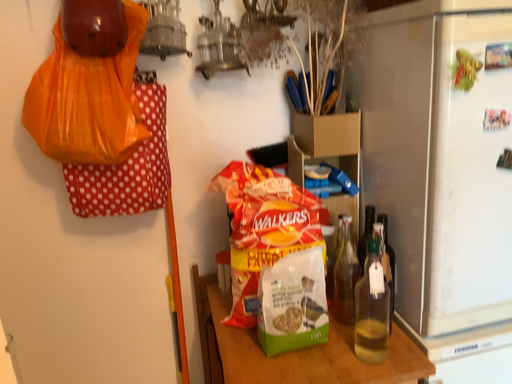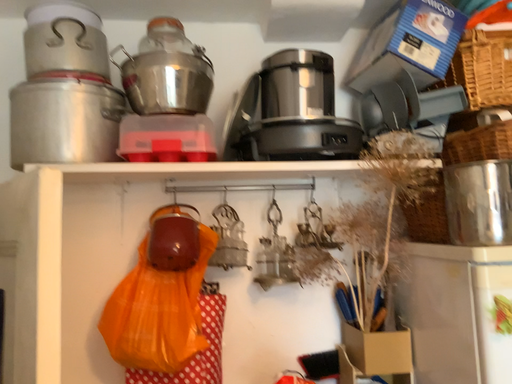
Question: How did the camera likely rotate when shooting the video?

Choices:
 (A) rotated left
 (B) rotated right

Answer: (A)